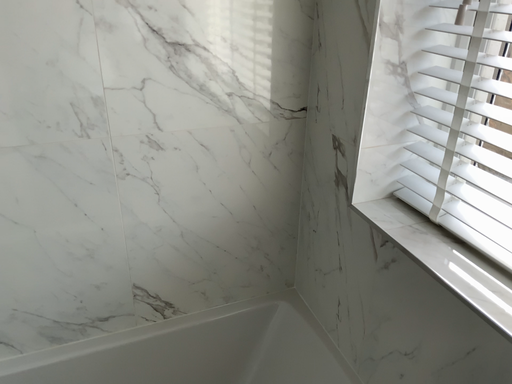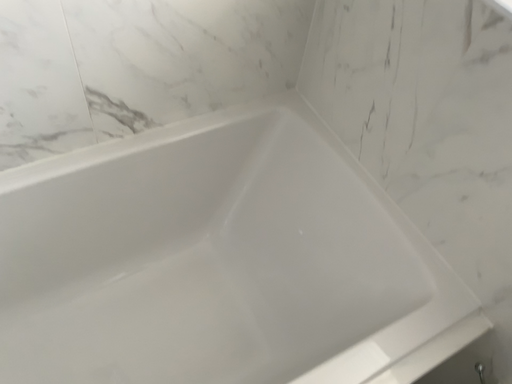
Question: How did the camera likely rotate when shooting the video?

Choices:
 (A) rotated right
 (B) rotated left

Answer: (A)